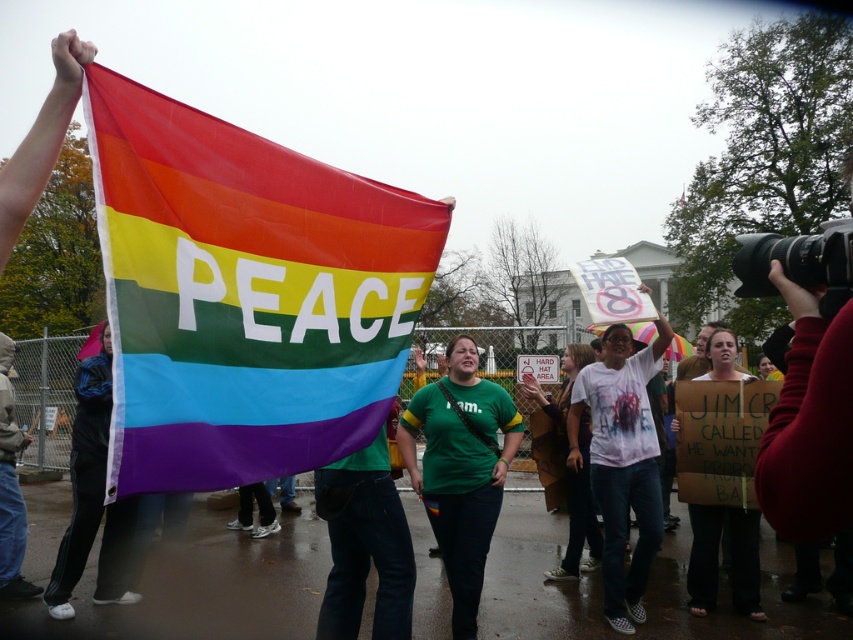
Question: Can you confirm if rainbow fabric flag at upper left is wider than white cotton shirt at center?

Choices:
 (A) no
 (B) yes

Answer: (B)

Question: Considering the real-world distances, which object is farthest from the rainbow fabric flag at upper left?

Choices:
 (A) green denim jeans at center
 (B) white cotton shirt at center
 (C) green t-shirt at center

Answer: (B)

Question: Which point appears farthest from the camera in this image?

Choices:
 (A) (639, 612)
 (B) (407, 545)
 (C) (212, 401)
 (D) (541, 449)

Answer: (D)

Question: In this image, where is white printed t-shirt at center located relative to green denim jeans at center?

Choices:
 (A) below
 (B) above

Answer: (A)

Question: Is green t-shirt at center further to the viewer compared to cardboard sign at center?

Choices:
 (A) yes
 (B) no

Answer: (B)

Question: Which point appears farthest from the camera in this image?

Choices:
 (A) (408, 195)
 (B) (558, 480)

Answer: (B)